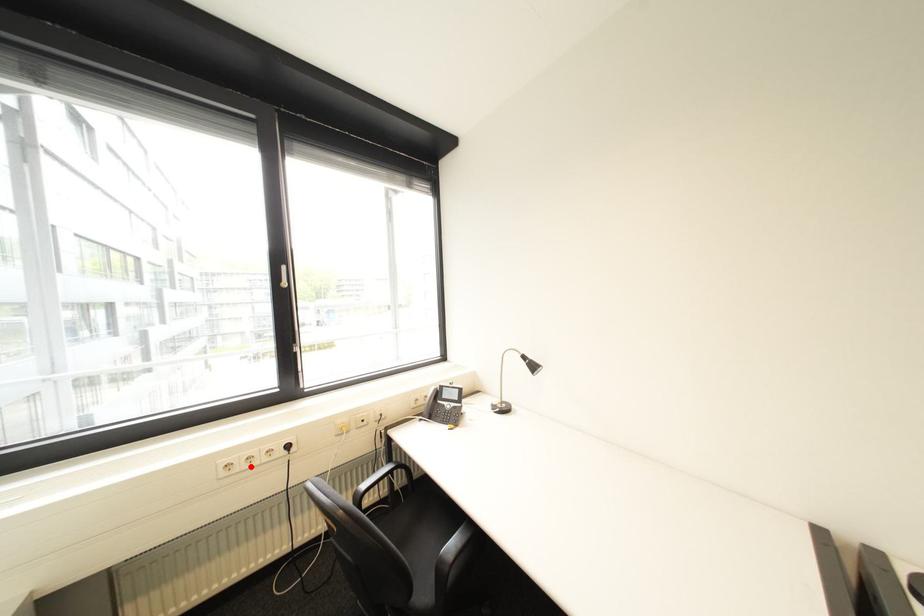
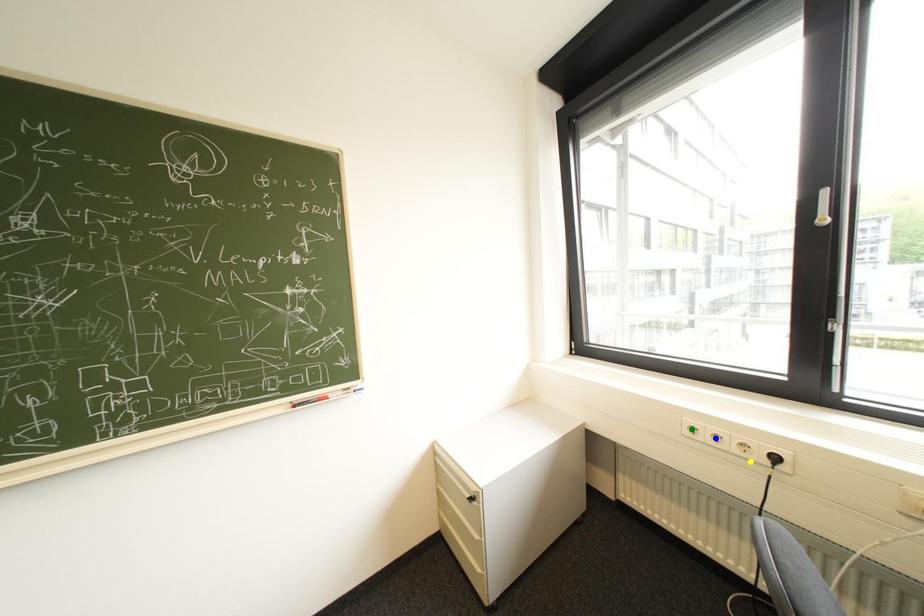
Question: I am providing you with two images of the same scene from different viewpoints. A red point is marked on the first image. You are given multiple points on the second image. Which point in image 2 represents the same 3d spot as the red point in image 1?

Choices:
 (A) yellow point
 (B) blue point
 (C) green point

Answer: (B)